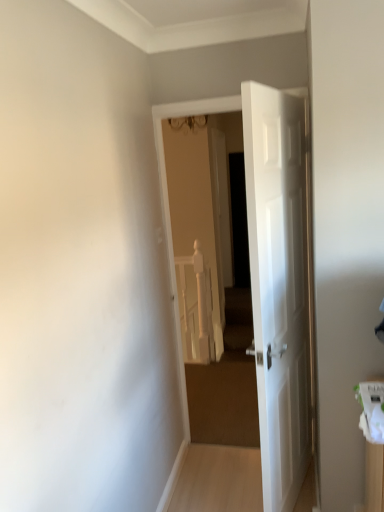
This screenshot has height=512, width=384. Describe the element at coordinates (279, 284) in the screenshot. I see `white glossy door at center` at that location.

You are a GUI agent. You are given a task and a screenshot of the screen. Output one action in this format:
    pyautogui.click(x=<x>, y=<y>)
    Task: Click on the white glossy door at center
    
    Given the screenshot: What is the action you would take?
    tap(279, 284)

In order to face white glossy door at center, should I rotate leftwards or rightwards?

Turn right approximately 12.591 degrees to face it.

You are a GUI agent. You are given a task and a screenshot of the screen. Output one action in this format:
    pyautogui.click(x=<x>, y=<y>)
    Task: Click on the white glossy door at center
    This screenshot has height=512, width=384.
    Given the screenshot: What is the action you would take?
    pyautogui.click(x=279, y=284)